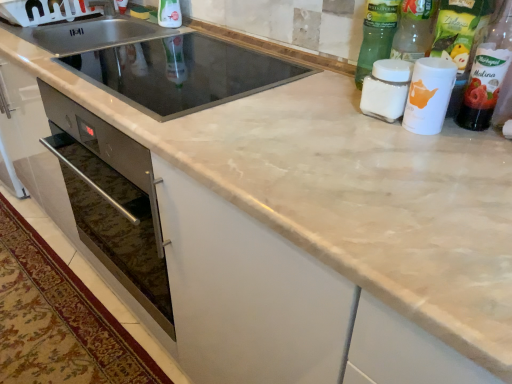
At what (x,y) coordinates should I click in order to perform the action: click on vacant space to the left of white matte cup at upper right, which ranks as the 3th bottle in right-to-left order. Please return your answer as a coordinate pair (x, y). The width and height of the screenshot is (512, 384). Looking at the image, I should click on (338, 124).